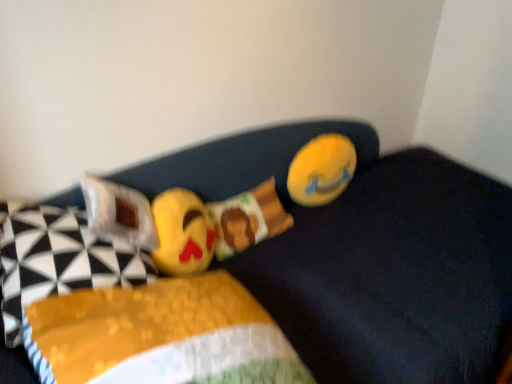
Question: Does soft plush emoji at center, which is the 2th toy in right-to-left order, come in front of yellow plush toy at upper right, the 1th toy viewed from the back?

Choices:
 (A) yes
 (B) no

Answer: (A)

Question: Is soft plush emoji at center, which ranks as the 1th toy in left-to-right order, surrounding yellow plush toy at upper right, which is the 2th toy in left-to-right order?

Choices:
 (A) yes
 (B) no

Answer: (B)

Question: Is soft plush emoji at center, the second toy positioned from the back, further to camera compared to yellow plush toy at upper right, which is the 2th toy in left-to-right order?

Choices:
 (A) no
 (B) yes

Answer: (A)

Question: Is soft plush emoji at center, positioned as the 1th toy in front-to-back order, positioned beyond the bounds of yellow plush toy at upper right, which is the 2th toy in left-to-right order?

Choices:
 (A) no
 (B) yes

Answer: (B)

Question: Is soft plush emoji at center, the second toy positioned from the back, oriented away from yellow plush toy at upper right, acting as the 2th toy starting from the front?

Choices:
 (A) no
 (B) yes

Answer: (A)

Question: From a real-world perspective, is soft plush emoji at center, positioned as the 1th toy in front-to-back order, on top of yellow plush toy at upper right, the 1th toy viewed from the back?

Choices:
 (A) no
 (B) yes

Answer: (B)

Question: Does yellow fabric pillow at center come in front of soft plush emoji at center, which ranks as the 1th toy in left-to-right order?

Choices:
 (A) yes
 (B) no

Answer: (A)

Question: Does yellow fabric pillow at center have a smaller size compared to soft plush emoji at center, the second toy positioned from the back?

Choices:
 (A) yes
 (B) no

Answer: (B)

Question: Considering the relative positions of yellow fabric pillow at center and soft plush emoji at center, which is the 2th toy in right-to-left order, in the image provided, is yellow fabric pillow at center behind soft plush emoji at center, which is the 2th toy in right-to-left order,?

Choices:
 (A) yes
 (B) no

Answer: (B)

Question: Is yellow fabric pillow at center positioned with its back to soft plush emoji at center, the second toy positioned from the back?

Choices:
 (A) yes
 (B) no

Answer: (B)

Question: Is yellow fabric pillow at center to the left of soft plush emoji at center, the second toy positioned from the back, from the viewer's perspective?

Choices:
 (A) yes
 (B) no

Answer: (B)

Question: Can you confirm if yellow fabric pillow at center is shorter than soft plush emoji at center, which ranks as the 1th toy in left-to-right order?

Choices:
 (A) no
 (B) yes

Answer: (A)

Question: Is yellow fabric pillow at left, marked as the 1th pillow in a left-to-right arrangement, inside soft plush emoji at center, positioned as the 1th toy in front-to-back order?

Choices:
 (A) no
 (B) yes

Answer: (A)